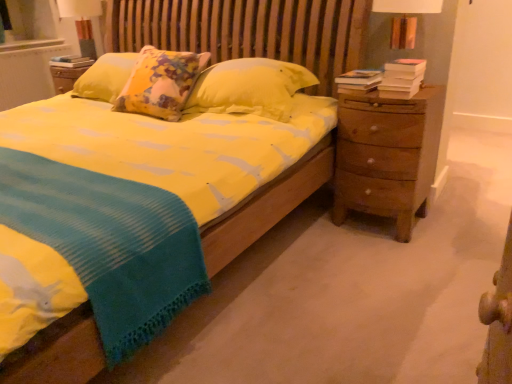
Question: Is hardcover book at upper left, which is the third book in right-to-left order, in front of hardcover books at right, the 2th book from the back?

Choices:
 (A) yes
 (B) no

Answer: (B)

Question: Is hardcover book at upper left, which is the third book in right-to-left order, outside hardcover books at right, acting as the second book starting from the left?

Choices:
 (A) yes
 (B) no

Answer: (A)

Question: Is hardcover book at upper left, the first book viewed from the top, at the right side of hardcover books at right, which is counted as the second book, starting from the front?

Choices:
 (A) no
 (B) yes

Answer: (A)

Question: Is hardcover book at upper left, acting as the third book starting from the front, bigger than hardcover books at right, which is counted as the second book, starting from the front?

Choices:
 (A) no
 (B) yes

Answer: (B)

Question: Considering the relative positions of hardcover book at upper left, arranged as the first book when viewed from the back, and hardcover books at right, the 2th book ordered from the bottom, in the image provided, is hardcover book at upper left, arranged as the first book when viewed from the back, to the left of hardcover books at right, the 2th book ordered from the bottom, from the viewer's perspective?

Choices:
 (A) yes
 (B) no

Answer: (A)

Question: From a real-world perspective, is hardcover book at upper left, which is the third book in right-to-left order, on top of hardcover books at right, the 2th book ordered from the bottom?

Choices:
 (A) yes
 (B) no

Answer: (A)

Question: From the image's perspective, is white textured radiator at upper left located beneath hardcover books at right, the second book when ordered from right to left?

Choices:
 (A) yes
 (B) no

Answer: (B)

Question: Can you confirm if white textured radiator at upper left is positioned to the right of hardcover books at right, which ranks as the 2th book in top-to-bottom order?

Choices:
 (A) yes
 (B) no

Answer: (B)

Question: Considering the relative sizes of white textured radiator at upper left and hardcover books at right, acting as the second book starting from the left, in the image provided, is white textured radiator at upper left smaller than hardcover books at right, acting as the second book starting from the left,?

Choices:
 (A) yes
 (B) no

Answer: (B)

Question: Does white textured radiator at upper left come in front of hardcover books at right, the second book when ordered from right to left?

Choices:
 (A) yes
 (B) no

Answer: (B)

Question: Does white textured radiator at upper left have a larger size compared to hardcover books at right, the 2th book ordered from the bottom?

Choices:
 (A) yes
 (B) no

Answer: (A)

Question: Is white textured radiator at upper left positioned with its back to hardcover books at right, which ranks as the 2th book in top-to-bottom order?

Choices:
 (A) yes
 (B) no

Answer: (B)

Question: Is matte white lampshade at upper left thinner than hardcover books at right, acting as the second book starting from the left?

Choices:
 (A) no
 (B) yes

Answer: (A)